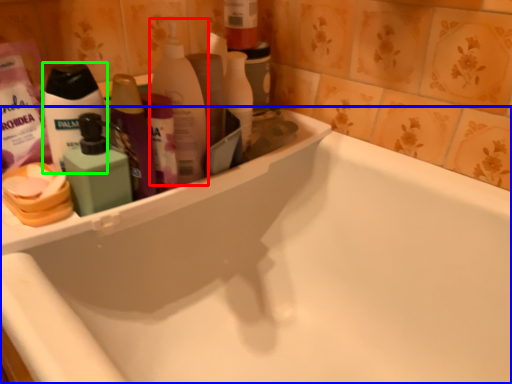
Question: Considering the real-world distances, which object is closest to cleaning product (highlighted by a red box)? bathtub (highlighted by a blue box) or toiletry (highlighted by a green box).

Choices:
 (A) bathtub
 (B) toiletry

Answer: (B)